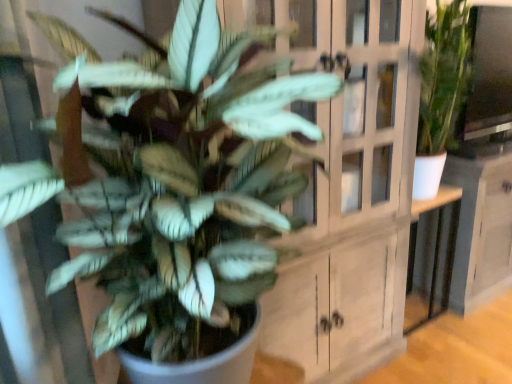
In order to face white wood cabinet at center, should I rotate leftwards or rightwards?

A 5.668 degree turn to the right will do.

The width and height of the screenshot is (512, 384). Describe the element at coordinates (344, 189) in the screenshot. I see `white wood cabinet at center` at that location.

Find the location of a particular element. white wood cabinet at center is located at coordinates click(344, 189).

Considering the sizes of objects white wood cabinet at center and green matte plant at center in the image provided, who is shorter, white wood cabinet at center or green matte plant at center?

green matte plant at center is shorter.

From the image's perspective, which is below, white wood cabinet at center or green matte plant at center?

From the image's view, green matte plant at center is below.

Is white wood cabinet at center smaller than green matte plant at center?

No.

Are white wood cabinet at center and green matte plant at center located far from each other?

No, white wood cabinet at center is not far away from green matte plant at center.

In terms of size, does white glossy table at center appear bigger or smaller than white wood cabinet at center?

In the image, white glossy table at center appears to be smaller than white wood cabinet at center.

Does white glossy table at center touch white wood cabinet at center?

No, white glossy table at center is not next to white wood cabinet at center.

Does point (411, 271) lie behind point (357, 296)?

Yes, it is behind point (357, 296).

Is green matte plant at center positioned far away from white wood cabinet at center?

green matte plant at center is near white wood cabinet at center, not far away.

Does green matte plant at center have a lesser width compared to white wood cabinet at center?

In fact, green matte plant at center might be wider than white wood cabinet at center.

Is point (106, 235) positioned in front of point (351, 1)?

Yes, point (106, 235) is in front of point (351, 1).

The height and width of the screenshot is (384, 512). Identify the location of dresser directly beneath the green matte plant at center (from a real-world perspective). (344, 189).

Is green matte plant at center inside or outside of white glossy table at center?

green matte plant at center is not enclosed by white glossy table at center.

From the image's perspective, relative to white glossy table at center, is green matte plant at center above or below?

Based on their image positions, green matte plant at center is located above white glossy table at center.

Is green matte plant at center in front of or behind white glossy table at center in the image?

green matte plant at center is in front of white glossy table at center.

Considering the relative positions of green matte plant at center and white glossy table at center in the image provided, is green matte plant at center to the left of white glossy table at center from the viewer's perspective?

Indeed, green matte plant at center is positioned on the left side of white glossy table at center.

Is white glossy table at center bigger than green matte plant at center?

No, white glossy table at center is not bigger than green matte plant at center.

Are white glossy table at center and green matte plant at center located far from each other?

Yes.

From the image's perspective, which one is positioned lower, white glossy table at center or green matte plant at center?

white glossy table at center is shown below in the image.

Does point (435, 284) come behind point (258, 292)?

Yes, it is.

Is white wood cabinet at center oriented away from white glossy table at center?

No, white wood cabinet at center is not facing the opposite direction of white glossy table at center.

From a real-world perspective, who is located higher, white wood cabinet at center or white glossy table at center?

white wood cabinet at center, from a real-world perspective.

Is white wood cabinet at center taller or shorter than white glossy table at center?

white wood cabinet at center is taller than white glossy table at center.

Which of these two, white wood cabinet at center or white glossy table at center, is bigger?

Bigger between the two is white wood cabinet at center.

Identify the location of dresser below the green matte plant at center (from a real-world perspective). click(344, 189).

The width and height of the screenshot is (512, 384). Identify the location of table on the right of white wood cabinet at center. (431, 256).

Estimate the real-world distances between objects in this image. Which object is closer to white glossy table at center, white wood cabinet at center or green matte plant at center?

Based on the image, white wood cabinet at center appears to be nearer to white glossy table at center.

From the picture: When comparing their distances from white glossy table at center, does green matte plant at center or white wood cabinet at center seem closer?

white wood cabinet at center is positioned closer to the anchor white glossy table at center.

Considering their positions, is white glossy table at center positioned further to green matte plant at center than white wood cabinet at center?

white glossy table at center is further to green matte plant at center.

Looking at the image, which one is located closer to white wood cabinet at center, green matte plant at center or white glossy table at center?

Among the two, green matte plant at center is located nearer to white wood cabinet at center.

Estimate the real-world distances between objects in this image. Which object is further from green matte plant at center, white wood cabinet at center or white glossy table at center?

white glossy table at center.

Looking at the image, which one is located closer to white wood cabinet at center, white glossy table at center or green matte plant at center?

Among the two, green matte plant at center is located nearer to white wood cabinet at center.

Find the location of a particular element. dresser located between green matte plant at center and white glossy table at center in the depth direction is located at coordinates (344, 189).